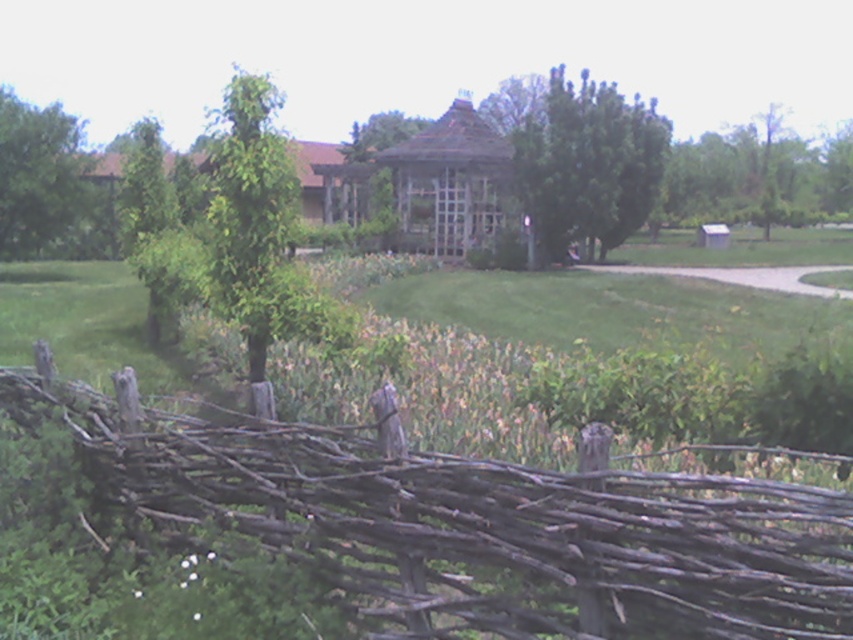
Does green leafy tree at center have a greater width compared to green leafy tree at upper left?

Indeed, green leafy tree at center has a greater width compared to green leafy tree at upper left.

Is point (550, 132) positioned before point (39, 180)?

No, (550, 132) is further to viewer.

Who is more distant from viewer, [572,237] or [7,257]?

The point [572,237] is behind.

This screenshot has width=853, height=640. Find the location of `green leafy tree at center`. green leafy tree at center is located at coordinates (589, 163).

Image resolution: width=853 pixels, height=640 pixels. What do you see at coordinates (474, 522) in the screenshot? I see `brown rustic fence at lower left` at bounding box center [474, 522].

Which is more to the left, brown rustic fence at lower left or green leafy tree at upper left?

green leafy tree at upper left

Is point (292, 522) more distant than point (3, 204)?

That is False.

What are the coordinates of `brown rustic fence at lower left` in the screenshot? It's located at (474, 522).

Between green leafy tree at upper right and green leafy tree at upper left, which one has less height?

green leafy tree at upper left

Between point (764, 196) and point (15, 134), which one is positioned behind?

Positioned behind is point (764, 196).

Does point (848, 164) lie behind point (44, 224)?

Yes, point (848, 164) is behind point (44, 224).

Find the location of a particular element. The image size is (853, 640). green leafy tree at upper right is located at coordinates (757, 177).